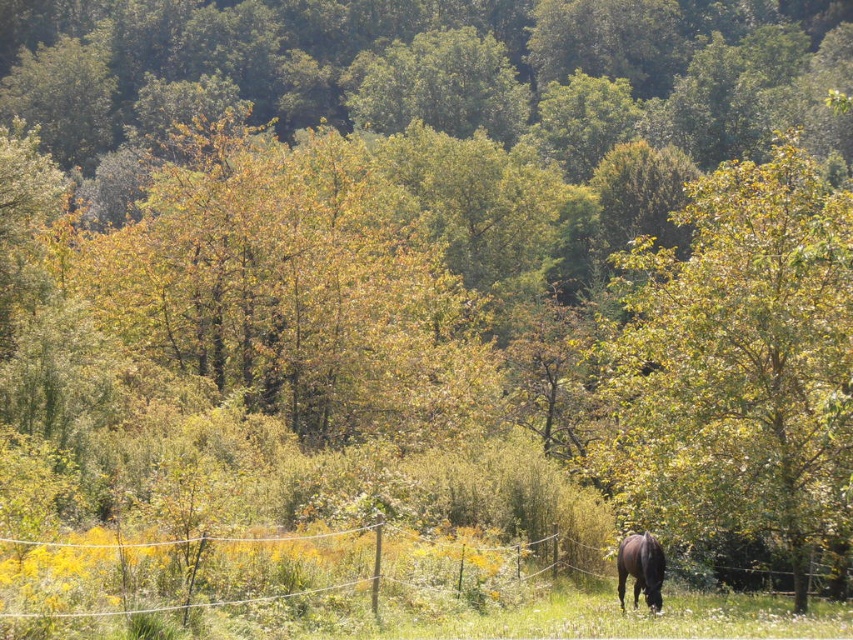
You are standing at the point marked by the coordinate point (x=740, y=365) in the image, which is the location of the green leafy tree at center. You want to walk towards the dark horse in the middle right. Which direction should you head?

You should head towards the middle right direction to reach the dark horse in the middle right from the green leafy tree at center marked by point (x=740, y=365).

You are standing at the origin point in the image and want to walk towards the point at the bottom right corner. Which of the two points, point (828, 480) or point (645, 595), will you encounter first along your path?

Point (645, 595) will be encountered first because it is closer to the bottom right corner compared to point (828, 480), which is positioned further behind it.

You are a farmer checking the pasture. You notice the wire mesh at lower right and the black glossy horse at lower right. Which object is positioned higher in the image?

The wire mesh at lower right is above the black glossy horse at lower right, so the wire mesh at lower right is positioned higher in the image.